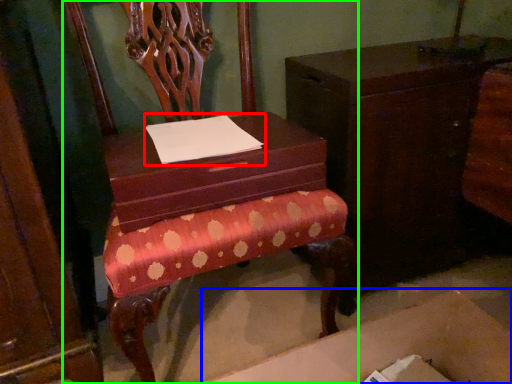
Question: Considering the real-world distances, which object is closest to notepad (highlighted by a red box)? cardboard box (highlighted by a blue box) or chair (highlighted by a green box).

Choices:
 (A) cardboard box
 (B) chair

Answer: (B)